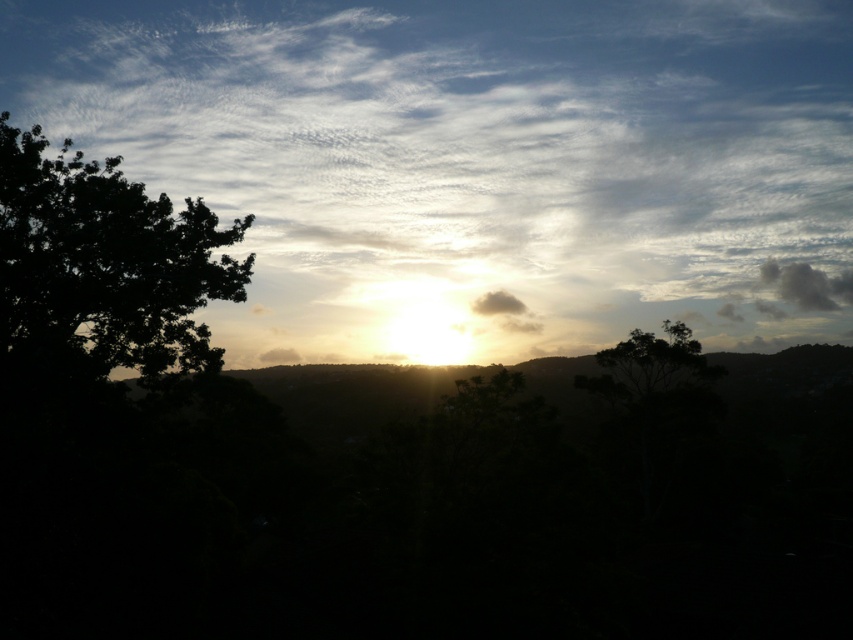
Question: Considering the relative positions of dark leafy tree at left and gray fluffy cloud at upper right in the image provided, where is dark leafy tree at left located with respect to gray fluffy cloud at upper right?

Choices:
 (A) below
 (B) above

Answer: (B)

Question: Estimate the real-world distances between objects in this image. Which object is closer to the white fluffy cloud at upper center?

Choices:
 (A) dark leafy tree at left
 (B) gray fluffy cloud at upper right

Answer: (B)

Question: Which is farther from the dark green leafy tree at center?

Choices:
 (A) gray fluffy cloud at upper right
 (B) white fluffy cloud at upper center

Answer: (A)

Question: Can you confirm if white fluffy cloud at upper center is positioned to the left of dark leafy tree at left?

Choices:
 (A) yes
 (B) no

Answer: (B)

Question: Can you confirm if dark green leafy tree at center is wider than gray fluffy cloud at upper right?

Choices:
 (A) no
 (B) yes

Answer: (A)

Question: Which is farther from the gray fluffy cloud at upper right?

Choices:
 (A) white fluffy cloud at upper center
 (B) dark leafy tree at left
 (C) dark green leafy tree at center

Answer: (B)